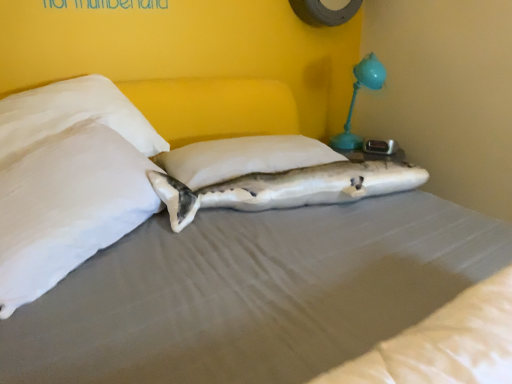
Question: Which direction should I rotate to look at white soft pillow at center, the 2th pillow viewed from the left?

Choices:
 (A) left
 (B) right

Answer: (A)

Question: Can you confirm if white soft pillow at center, the 2th pillow viewed from the left, is taller than white soft pillow at left, which appears as the first pillow when viewed from the left?

Choices:
 (A) no
 (B) yes

Answer: (A)

Question: From the image's perspective, does white soft pillow at center, the 2th pillow viewed from the left, appear lower than white soft pillow at left, the 2th pillow from the right?

Choices:
 (A) yes
 (B) no

Answer: (B)

Question: Does white soft pillow at center, the 2th pillow viewed from the left, lie in front of white soft pillow at left, which appears as the first pillow when viewed from the left?

Choices:
 (A) yes
 (B) no

Answer: (B)

Question: Does white soft pillow at center, which appears as the 1th pillow when viewed from the right, appear on the left side of white soft pillow at left, which appears as the first pillow when viewed from the left?

Choices:
 (A) no
 (B) yes

Answer: (A)

Question: Are white soft pillow at center, which appears as the 1th pillow when viewed from the right, and white soft pillow at left, which appears as the first pillow when viewed from the left, located far from each other?

Choices:
 (A) no
 (B) yes

Answer: (A)

Question: From a real-world perspective, is white soft pillow at center, the 2th pillow viewed from the left, located beneath white soft pillow at left, which appears as the first pillow when viewed from the left?

Choices:
 (A) no
 (B) yes

Answer: (B)

Question: Does teal plastic table lamp at upper right come behind white soft pillow at center, which appears as the 1th pillow when viewed from the right?

Choices:
 (A) no
 (B) yes

Answer: (B)

Question: Is teal plastic table lamp at upper right bigger than white soft pillow at center, the 2th pillow viewed from the left?

Choices:
 (A) yes
 (B) no

Answer: (A)

Question: Does teal plastic table lamp at upper right have a smaller size compared to white soft pillow at center, the 2th pillow viewed from the left?

Choices:
 (A) no
 (B) yes

Answer: (A)

Question: Does teal plastic table lamp at upper right have a greater width compared to white soft pillow at center, the 2th pillow viewed from the left?

Choices:
 (A) no
 (B) yes

Answer: (A)

Question: Can you confirm if teal plastic table lamp at upper right is positioned to the left of white soft pillow at center, which appears as the 1th pillow when viewed from the right?

Choices:
 (A) yes
 (B) no

Answer: (B)

Question: From a real-world perspective, is teal plastic table lamp at upper right positioned under white soft pillow at center, the 2th pillow viewed from the left, based on gravity?

Choices:
 (A) no
 (B) yes

Answer: (A)

Question: Does white soft pillow at left, which appears as the first pillow when viewed from the left, have a greater height compared to teal plastic table lamp at upper right?

Choices:
 (A) no
 (B) yes

Answer: (A)